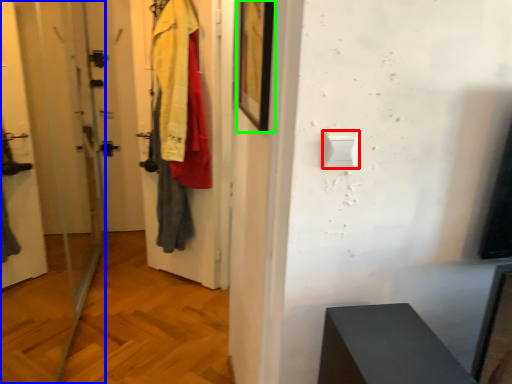
Question: Which object is the closest to the light switch (highlighted by a red box)? Choose among these: screen door (highlighted by a blue box) or picture frame (highlighted by a green box).

Choices:
 (A) screen door
 (B) picture frame

Answer: (B)